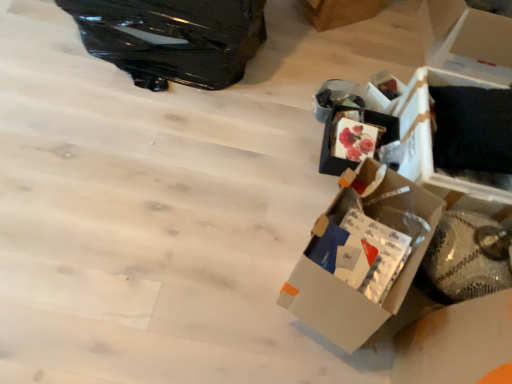
The width and height of the screenshot is (512, 384). What are the coordinates of `free space to the right of glossy black suitcase at upper left` in the screenshot? It's located at (298, 82).